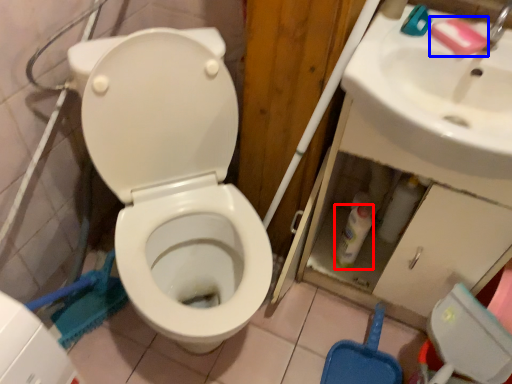
Question: Which of the following is the farthest to the observer, bottle (highlighted by a red box) or soap (highlighted by a blue box)?

Choices:
 (A) bottle
 (B) soap

Answer: (A)